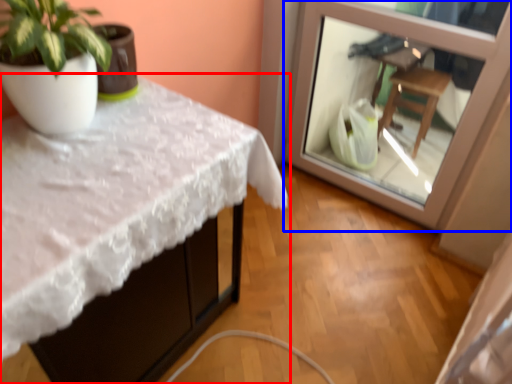
Question: Which object appears closest to the camera in this image, table (highlighted by a red box) or glass door (highlighted by a blue box)?

Choices:
 (A) table
 (B) glass door

Answer: (A)